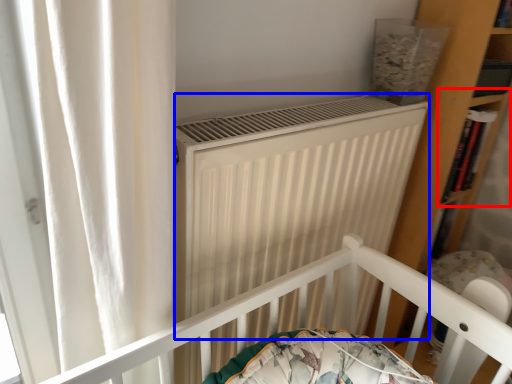
Question: Among these objects, which one is farthest to the camera, shelf (highlighted by a red box) or heater (highlighted by a blue box)?

Choices:
 (A) shelf
 (B) heater

Answer: (A)